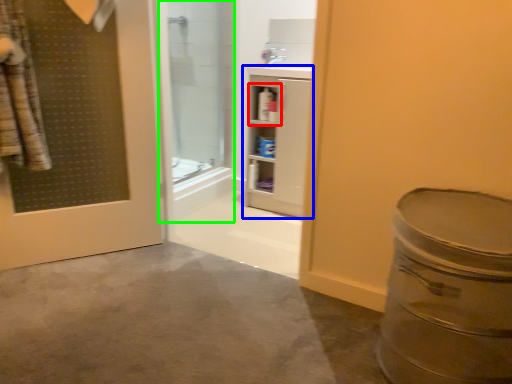
Question: Which object is positioned closest to cabinet (highlighted by a red box)? Select from bathroom cabinet (highlighted by a blue box) and shower door (highlighted by a green box).

Choices:
 (A) bathroom cabinet
 (B) shower door

Answer: (A)